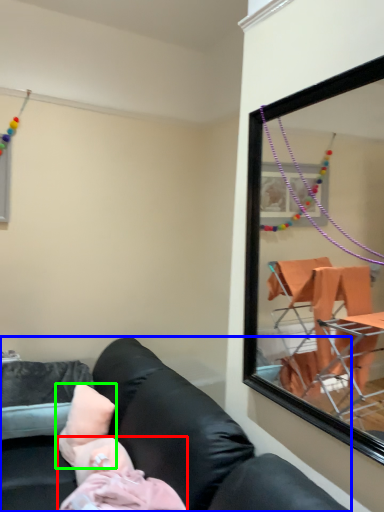
Question: Which object is positioned farthest from person (highlighted by a red box)? Select from studio couch (highlighted by a blue box) and pillow (highlighted by a green box).

Choices:
 (A) studio couch
 (B) pillow

Answer: (B)